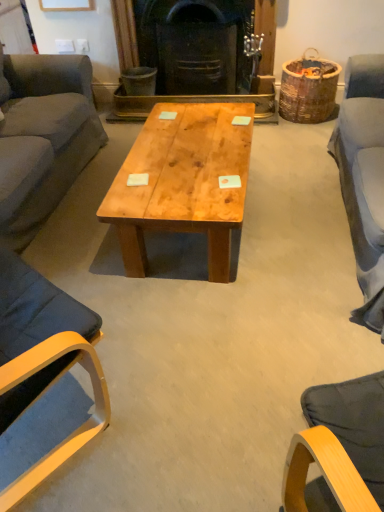
I want to click on free point above natural wood coffee table at center (from a real-world perspective), so click(186, 144).